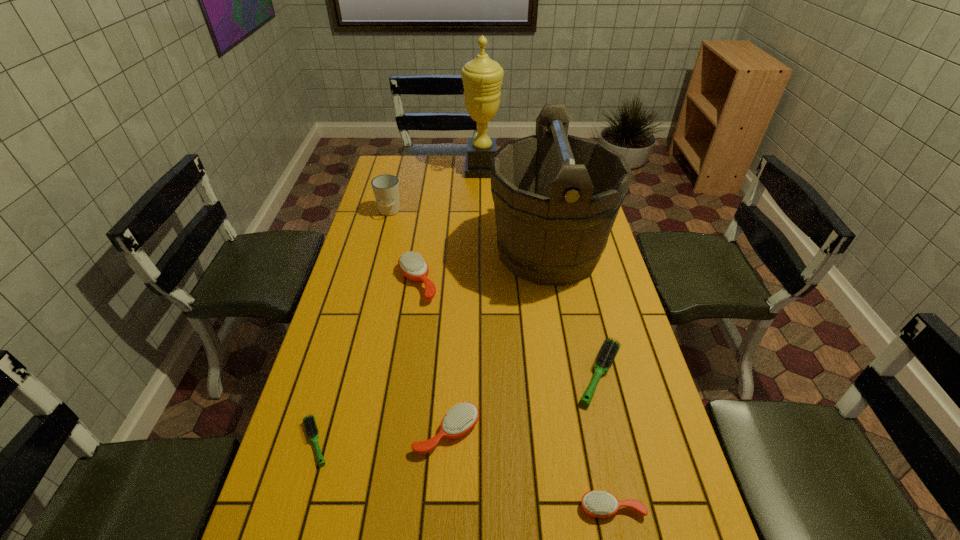
Identify which hairbrush is the fourth nearest to the third tallest object. Please provide its 2D coordinates. Your answer should be formatted as a tuple, i.e. [(x, y)], where the tuple contains the x and y coordinates of a point satisfying the conditions above.

[(309, 422)]

Locate which hairbrush ranks third in proximity to the leftmost hairbrush. Please provide its 2D coordinates. Your answer should be formatted as a tuple, i.e. [(x, y)], where the tuple contains the x and y coordinates of a point satisfying the conditions above.

[(601, 504)]

You are a GUI agent. You are given a task and a screenshot of the screen. Output one action in this format:
    pyautogui.click(x=<x>, y=<y>)
    Task: Click on the orange hairbrush that is the second nearest to the tallest hairbrush
    
    Given the screenshot: What is the action you would take?
    pyautogui.click(x=601, y=504)

Select which orange hairbrush is the closest to the trophy cup. Please provide its 2D coordinates. Your answer should be formatted as a tuple, i.e. [(x, y)], where the tuple contains the x and y coordinates of a point satisfying the conditions above.

[(412, 265)]

Locate which light hairbrush ranks second in proximity to the yellow trophy cup. Please provide its 2D coordinates. Your answer should be formatted as a tuple, i.e. [(x, y)], where the tuple contains the x and y coordinates of a point satisfying the conditions above.

[(309, 422)]

Find the location of `the second closest light hairbrush to the farthest hairbrush`. the second closest light hairbrush to the farthest hairbrush is located at coordinates (609, 349).

At what (x,y) coordinates should I click in order to perform the action: click on blank space that satisfies the following two spatial constraints: 1. at the front of the farthest object with handles; 2. on the right side of the seventh shortest object. Please return your answer as a coordinate pair (x, y). Image resolution: width=960 pixels, height=540 pixels. Looking at the image, I should click on (483, 252).